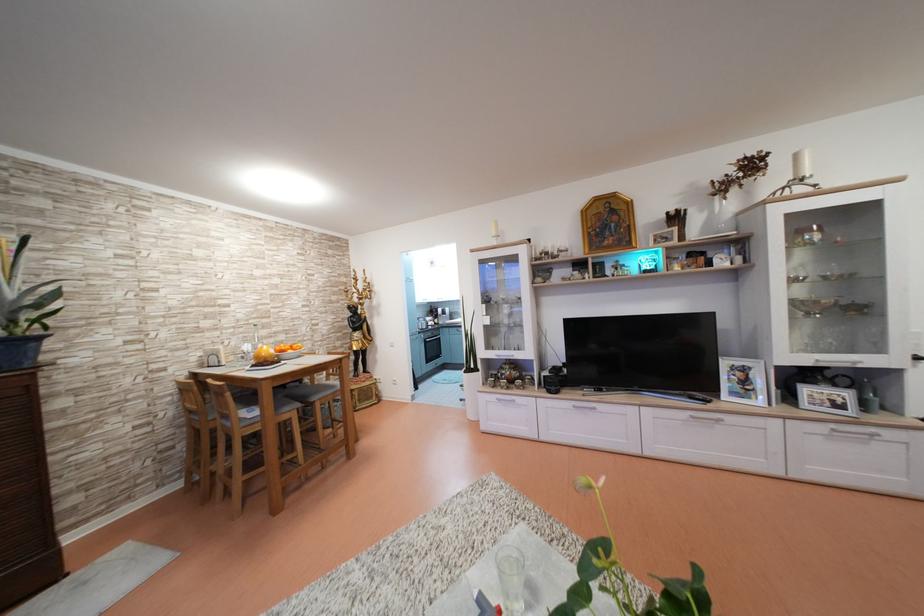
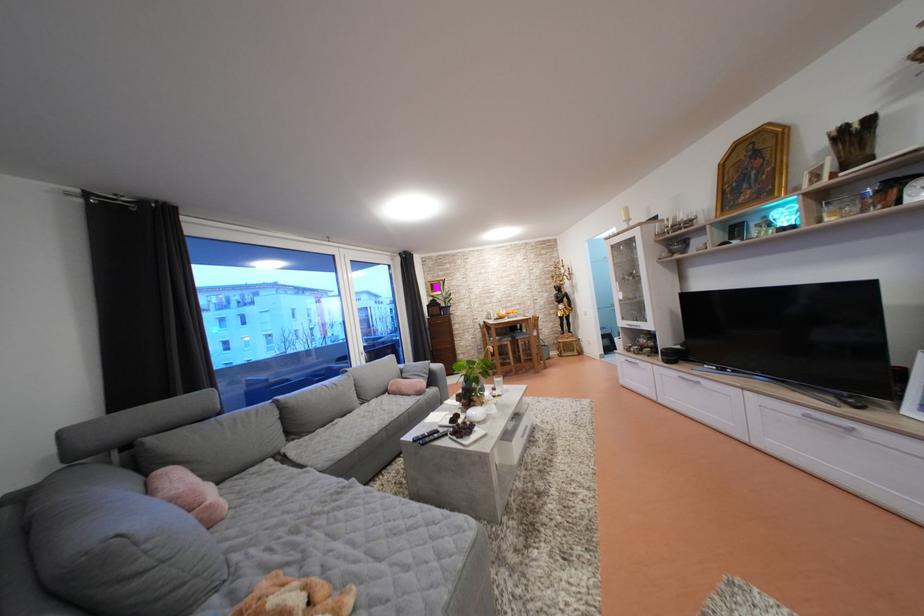
Question: I am providing you with two images of the same scene from different viewpoints. Which of the following objects are not visible in image2?

Choices:
 (A) grey sofa armrest
 (B) orange glass pitcher
 (C) black remote control
 (D) none of these

Answer: (D)